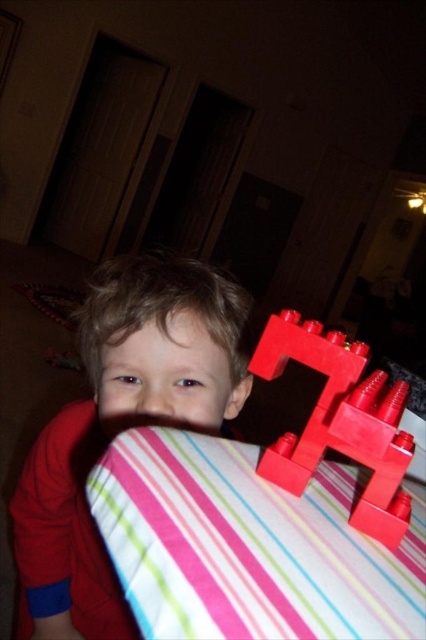
Question: Among these points, which one is nearest to the camera?

Choices:
 (A) (379, 433)
 (B) (161, 340)

Answer: (A)

Question: Does matte red toy at center have a smaller size compared to matte plastic toy at right?

Choices:
 (A) yes
 (B) no

Answer: (B)

Question: Is matte red toy at center further to camera compared to matte plastic toy at right?

Choices:
 (A) yes
 (B) no

Answer: (A)

Question: From the image, what is the correct spatial relationship of matte red toy at center in relation to matte plastic toy at right?

Choices:
 (A) above
 (B) below

Answer: (B)